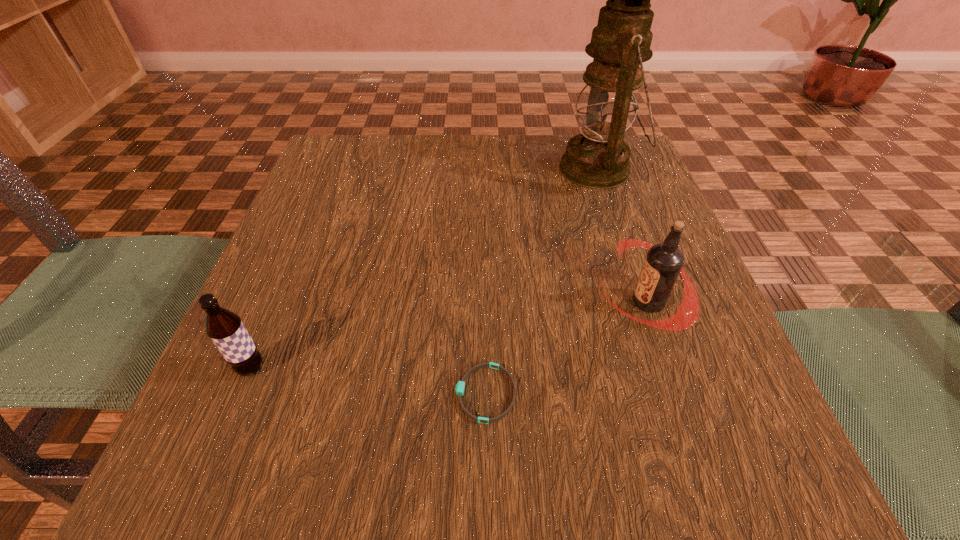
You are a GUI agent. You are given a task and a screenshot of the screen. Output one action in this format:
    pyautogui.click(x=<x>, y=<y>)
    Task: Click on the tallest object
    
    Given the screenshot: What is the action you would take?
    pyautogui.click(x=598, y=158)

Locate an element on the screen. the farthest object is located at coordinates (598, 158).

The width and height of the screenshot is (960, 540). Identify the location of the second farthest object. (664, 261).

This screenshot has height=540, width=960. I want to click on the right root beer, so click(x=664, y=261).

Image resolution: width=960 pixels, height=540 pixels. Find the location of `the nearer root beer`. the nearer root beer is located at coordinates (225, 328).

Find the location of a particular element. This screenshot has height=540, width=960. the left root beer is located at coordinates (225, 328).

You are a GUI agent. You are given a task and a screenshot of the screen. Output one action in this format:
    pyautogui.click(x=<x>, y=<y>)
    Task: Click on the second object from left to right
    
    Given the screenshot: What is the action you would take?
    click(460, 386)

The image size is (960, 540). Find the location of `the shortest object`. the shortest object is located at coordinates (460, 386).

In order to click on vacant space located 0.110m on the left of the farthest object in this screenshot , I will do `click(511, 169)`.

You are a GUI agent. You are given a task and a screenshot of the screen. Output one action in this format:
    pyautogui.click(x=<x>, y=<y>)
    Task: Click on the free location located 0.050m on the label of the right root beer
    The image size is (960, 540).
    Given the screenshot: What is the action you would take?
    pyautogui.click(x=572, y=302)